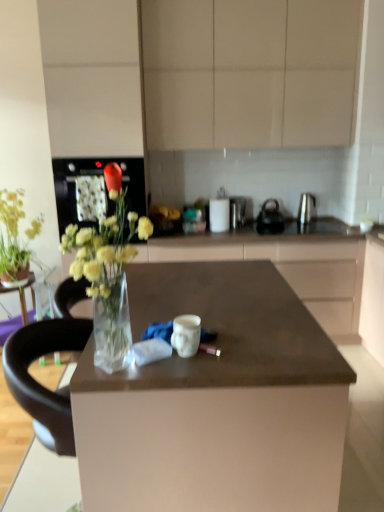
Question: Would you say satin silver kettle at right, positioned as the fourth appliance in left-to-right order, is to the left or to the right of polished stainless steel kettle at center, which ranks as the 3th appliance in left-to-right order, in the picture?

Choices:
 (A) left
 (B) right

Answer: (B)

Question: In terms of width, does satin silver kettle at right, the 1th appliance in the right-to-left sequence, look wider or thinner when compared to polished stainless steel kettle at center, which ranks as the 3th appliance in left-to-right order?

Choices:
 (A) thin
 (B) wide

Answer: (A)

Question: Estimate the real-world distances between objects in this image. Which object is closer to the satin silver kettle at right, the 1th appliance in the right-to-left sequence?

Choices:
 (A) white paper towel at center, arranged as the 1th appliance when viewed from the left
 (B) matte beige cabinets at upper center
 (C) green matte plant at upper left, the first flower from the back
 (D) matte red rose at center, which is the first flower from right to left
 (E) matte brown countertop at center

Answer: (A)

Question: Which object is the farthest from the green matte plant at upper left, which ranks as the first flower in left-to-right order?

Choices:
 (A) polished stainless steel kettle at center, which ranks as the 3th appliance in left-to-right order
 (B) matte brown countertop at center
 (C) matte beige cabinets at upper center
 (D) satin silver kettle at right, the 1th appliance in the right-to-left sequence
 (E) satin silver toaster at center, which is the third appliance in right-to-left order

Answer: (D)